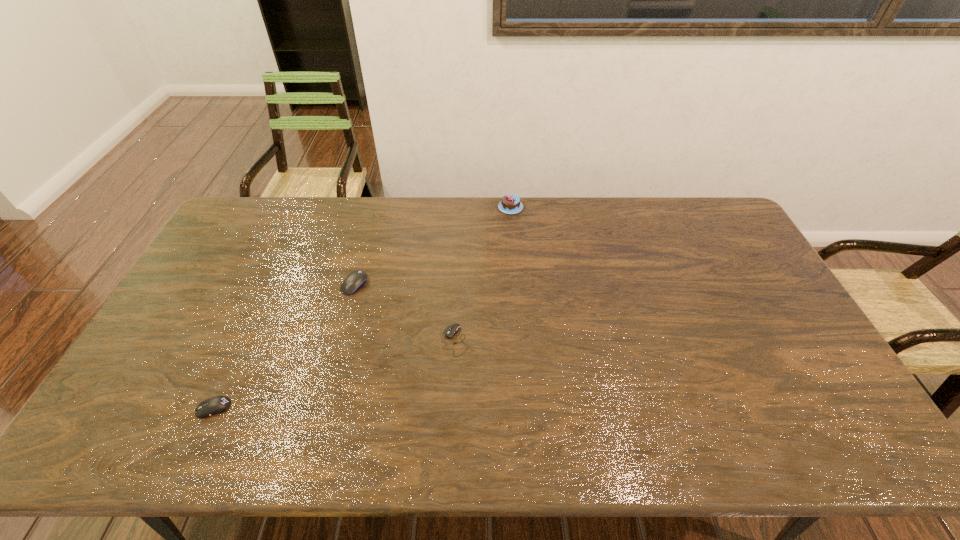
You are a GUI agent. You are given a task and a screenshot of the screen. Output one action in this format:
    pyautogui.click(x=<x>, y=<y>)
    Task: Click on the rightmost object
    The height and width of the screenshot is (540, 960).
    Given the screenshot: What is the action you would take?
    pyautogui.click(x=510, y=204)

Where is `chocolate cake`? chocolate cake is located at coordinates point(510,204).

Identify the location of the farthest computer mouse. (355, 280).

Where is `the second computer mouse from right to left`? This screenshot has width=960, height=540. the second computer mouse from right to left is located at coordinates 355,280.

This screenshot has width=960, height=540. I want to click on the second tallest computer mouse, so click(x=215, y=405).

Where is `the leftmost computer mouse`? the leftmost computer mouse is located at coordinates (215, 405).

Where is `the shortest object`? the shortest object is located at coordinates (450, 331).

The image size is (960, 540). Find the location of `the second object from right to left`. the second object from right to left is located at coordinates (450, 331).

You are a GUI agent. You are given a task and a screenshot of the screen. Output one action in this format:
    pyautogui.click(x=<x>, y=<y>)
    Task: Click on the vacant space located 0.090m on the left of the farthest object
    This screenshot has width=960, height=540.
    Given the screenshot: What is the action you would take?
    pyautogui.click(x=474, y=207)

Find the location of `vacant space located 0.180m on the front of the third nearest object`. vacant space located 0.180m on the front of the third nearest object is located at coordinates (339, 344).